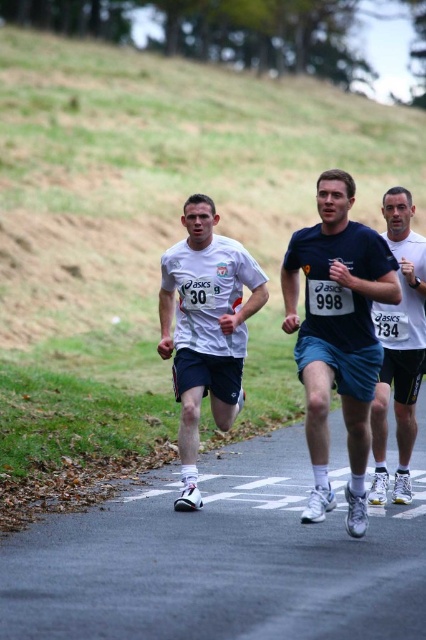
Question: Can you confirm if green grass at upper left is wider than white matte running shoe at right?

Choices:
 (A) no
 (B) yes

Answer: (B)

Question: Which point appears farthest from the camera in this image?

Choices:
 (A) (209, 186)
 (B) (238, 406)

Answer: (A)

Question: Is dark blue shorts at center wider than white matte shirt at center?

Choices:
 (A) no
 (B) yes

Answer: (A)

Question: Which is farther from the green grass at upper left?

Choices:
 (A) white matte shirt at center
 (B) white matte running shoe at right

Answer: (B)

Question: Is green grass at upper left to the left of dark blue shorts at center from the viewer's perspective?

Choices:
 (A) yes
 (B) no

Answer: (A)

Question: Which of the following is the closest to the observer?

Choices:
 (A) (108, 157)
 (B) (328, 413)
 (C) (201, 243)
 (D) (405, 392)

Answer: (B)